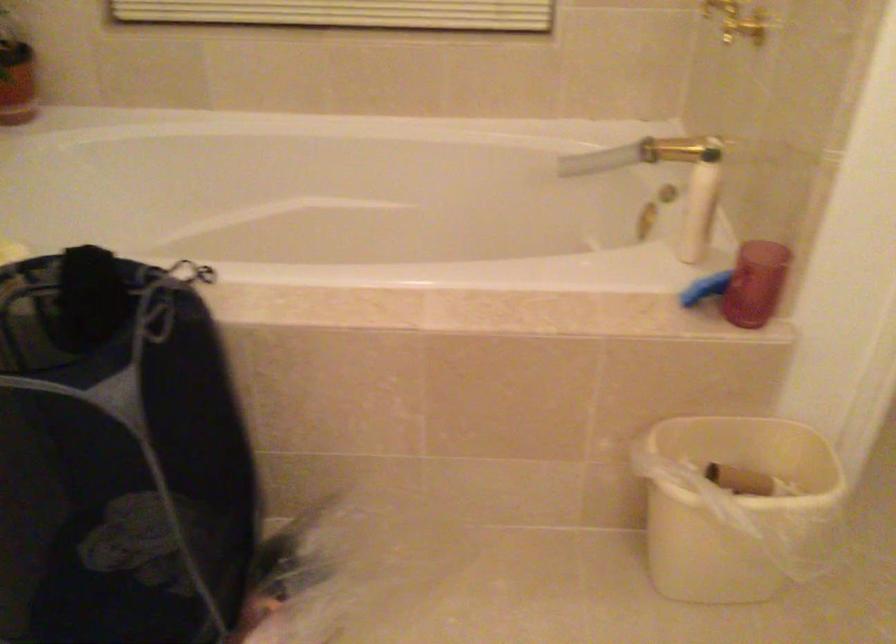
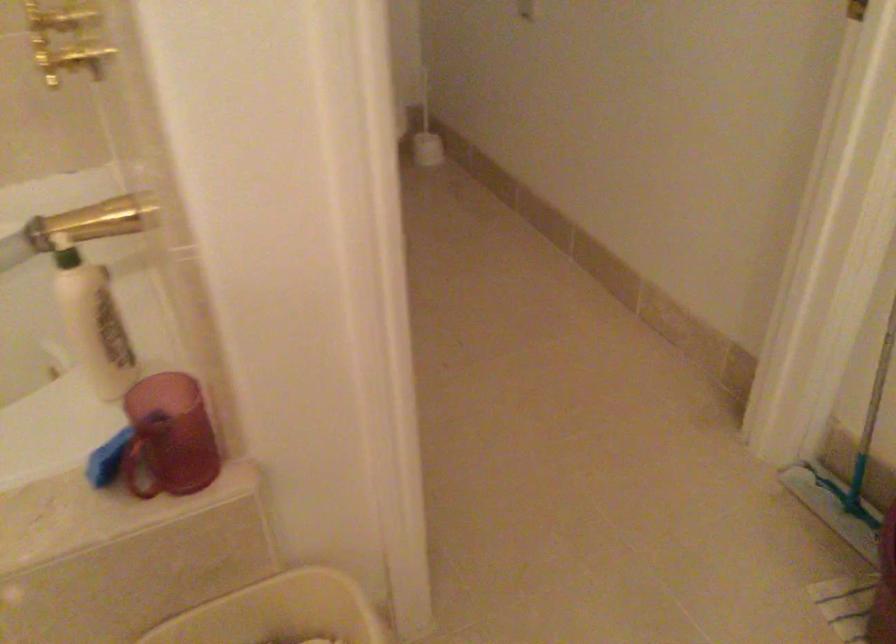
In the scene shown: In a continuous first-person perspective shot, in which direction is the camera moving?

The movement direction of the cameraman is right, forward.